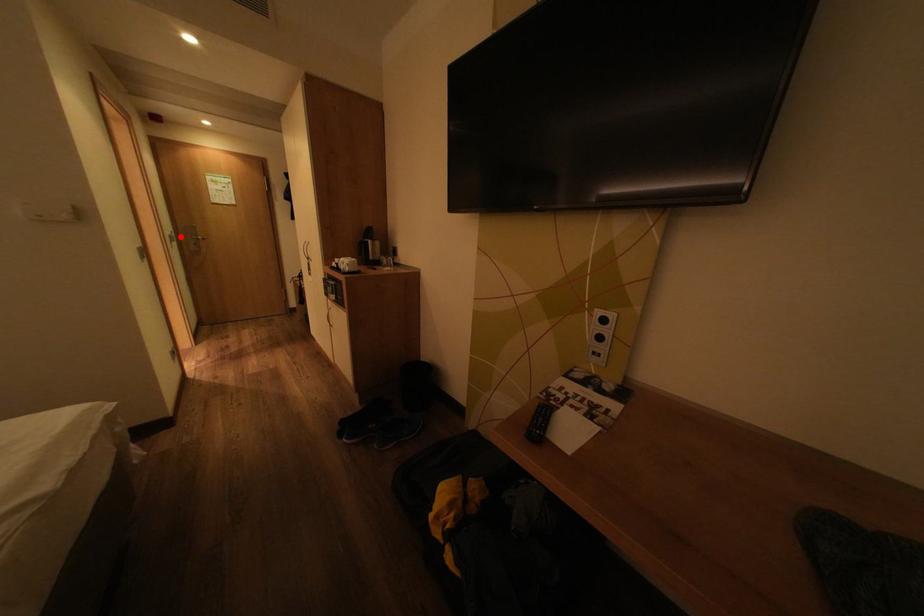
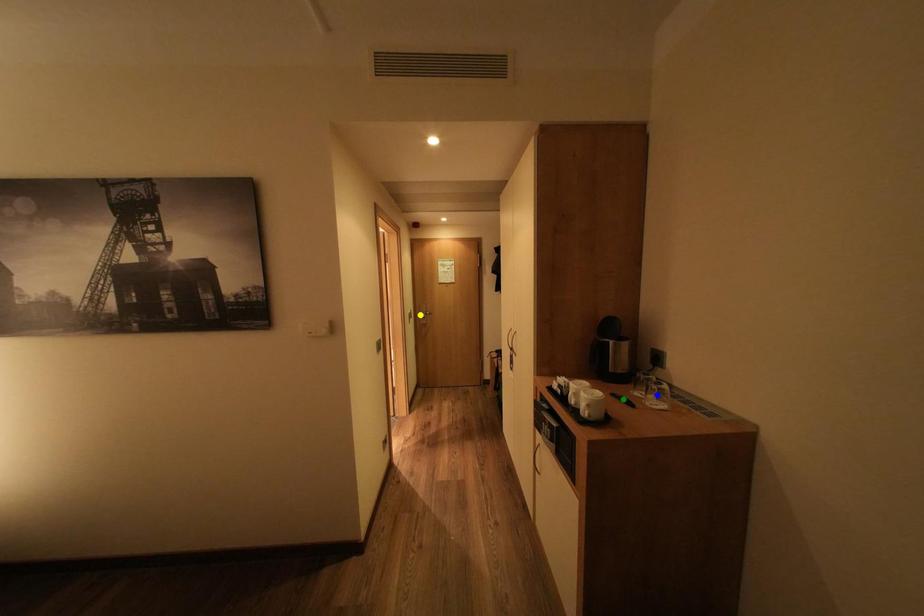
Question: I am providing you with two images of the same scene from different viewpoints. A red point is marked on the first image. You are given multiple points on the second image. Which mark in image 2 goes with the point in image 1?

Choices:
 (A) blue point
 (B) yellow point
 (C) green point

Answer: (B)